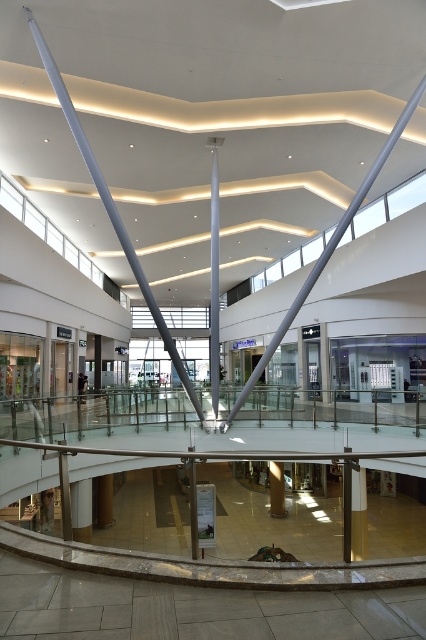
You are standing at the entrance of the mall and notice two beams. One is the silver metallic beam at center and the other is the polished silver beam at center. Which beam do you see first as you look towards the center of the mall?

The silver metallic beam at center is closer to the viewer than the polished silver beam at center, so you would see the silver metallic beam at center first as you look towards the center of the mall.

You are a customer in the mall and want to locate the information desk. The desk is placed between the matte silver beam at center and the gold polished pillar at center. Which object should you stand closer to if the desk is closer to the left side of the pillar?

The information desk is closer to the left side of the gold polished pillar at center, so you should stand closer to the matte silver beam at center since it is positioned on the left side of the gold polished pillar at center.